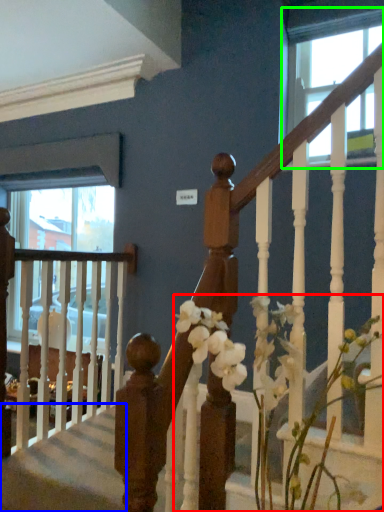
Question: Which object is the farthest from floral arrangement (highlighted by a red box)? Choose among these: stairwell (highlighted by a blue box) or window (highlighted by a green box).

Choices:
 (A) stairwell
 (B) window

Answer: (B)